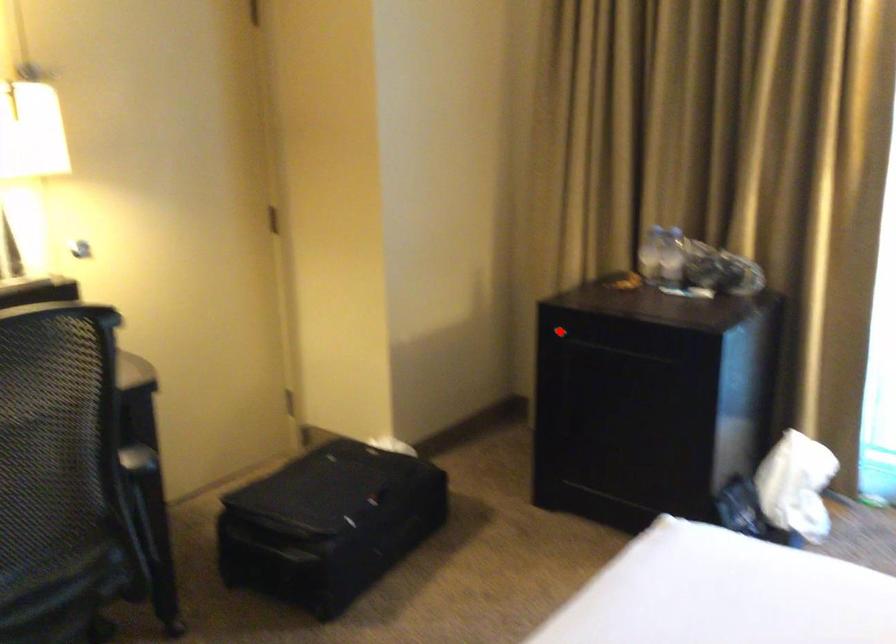
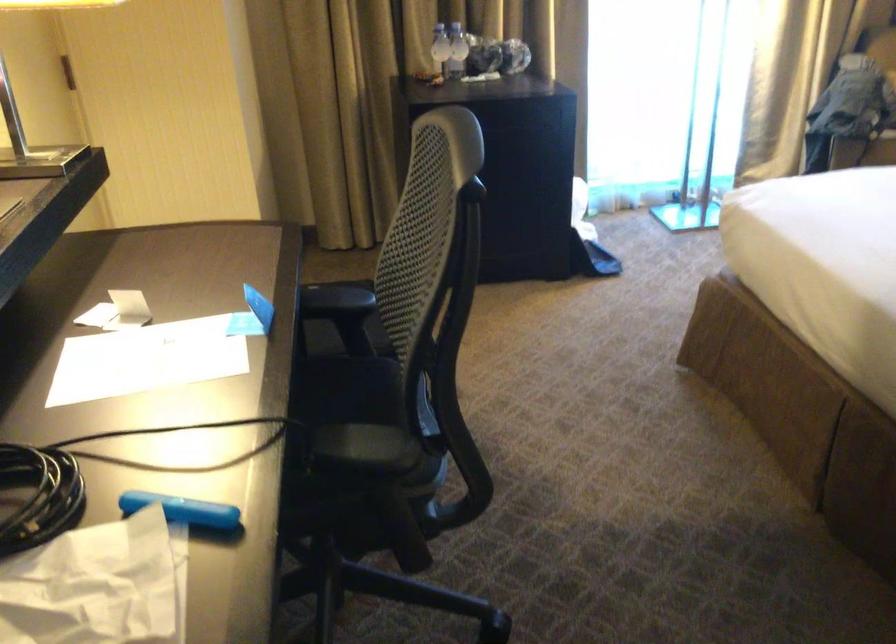
Question: I am providing you with two images of the same scene from different viewpoints. A red point is marked on the first image. Can you still see the location of the red point in image 2?

Choices:
 (A) Yes
 (B) No

Answer: (B)